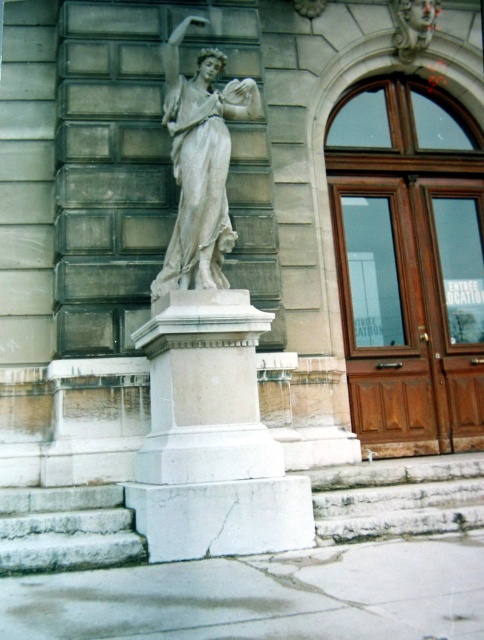
You are standing in front of the statue and want to place a small bouquet at a specific point marked as point [89,532]. If you are currently 5 meters away from the statue, can you reach the point without moving closer?

The point [89,532] is 5.14 meters from the viewer. Since you are currently 5 meters away from the statue, you need to move 0.14 meters closer to reach it.

You are standing in front of the statue and want to place a bouquet of flowers at the exact point marked by the coordinates (211, 436). Where should you place the bouquet?

The point marked by the coordinates (211, 436) is the white marble pedestal at center, so you should place the bouquet on the white marble pedestal at center.

You are an art conservator assessing the statue and its pedestal. Given that the pedestal is larger than the statue, which object would require more material for a protective coating? Please refer to the white marble pedestal at center and the white marble statue at center in your answer.

The white marble pedestal at center is bigger than the white marble statue at center, so it would require more material for a protective coating.